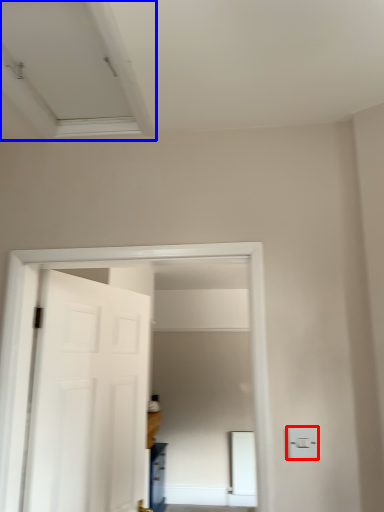
Question: Among these objects, which one is nearest to the camera, light switch (highlighted by a red box) or exhaust hood (highlighted by a blue box)?

Choices:
 (A) light switch
 (B) exhaust hood

Answer: (B)